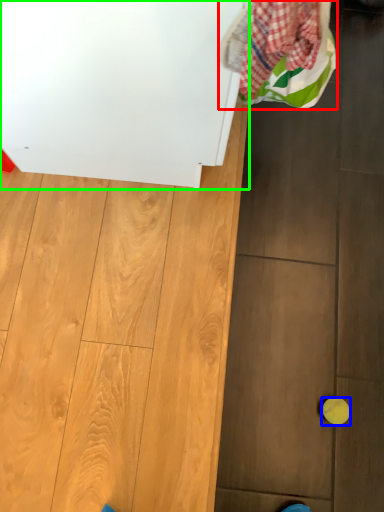
Question: Based on their relative distances, which object is nearer to laundry (highlighted by a red box)? Choose from ball (highlighted by a blue box) and appliance (highlighted by a green box).

Choices:
 (A) ball
 (B) appliance

Answer: (B)